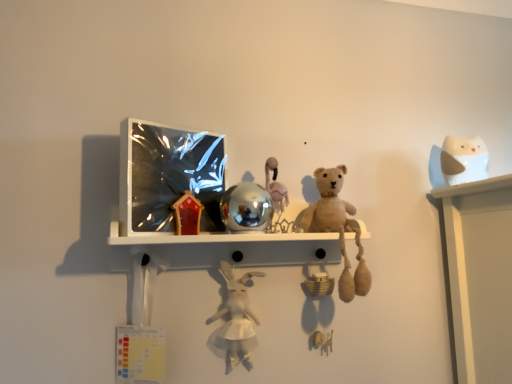
Where is `metallic reflective shelf at center`? This screenshot has height=384, width=512. metallic reflective shelf at center is located at coordinates (213, 237).

What do you see at coordinates (463, 160) in the screenshot?
I see `white matte owl at upper right, which appears as the 4th toy when viewed from the left` at bounding box center [463, 160].

What do you see at coordinates (236, 318) in the screenshot? I see `white plush rabbit at center, which appears as the 4th toy when viewed from the right` at bounding box center [236, 318].

Describe the element at coordinates (337, 228) in the screenshot. I see `fuzzy beige teddy bear at center, marked as the second toy in a right-to-left arrangement` at that location.

The image size is (512, 384). What do you see at coordinates (246, 207) in the screenshot? I see `shiny metallic ball at center, which is counted as the second toy, starting from the left` at bounding box center [246, 207].

Find the location of a particular element. This screenshot has height=384, width=512. metallic reflective shelf at center is located at coordinates (213, 237).

Which is farther, (224,222) or (453,183)?

The point (453,183) is more distant.

Which of these two, shiny metallic ball at center, which is counted as the third toy, starting from the right, or white matte owl at upper right, positioned as the 1th toy in right-to-left order, is smaller?

With smaller size is white matte owl at upper right, positioned as the 1th toy in right-to-left order.

From a real-world perspective, which is physically above, shiny metallic ball at center, which is counted as the third toy, starting from the right, or white matte owl at upper right, which appears as the 4th toy when viewed from the left?

In real-world perspective, white matte owl at upper right, which appears as the 4th toy when viewed from the left, is above.

Consider the image. Is shiny metallic ball at center, which is counted as the third toy, starting from the right, with white matte owl at upper right, which appears as the 4th toy when viewed from the left?

No, shiny metallic ball at center, which is counted as the third toy, starting from the right, is not in contact with white matte owl at upper right, which appears as the 4th toy when viewed from the left.

Considering the sizes of objects white matte owl at upper right, positioned as the 1th toy in right-to-left order, and metallic reflective shelf at center in the image provided, who is taller, white matte owl at upper right, positioned as the 1th toy in right-to-left order, or metallic reflective shelf at center?

With more height is white matte owl at upper right, positioned as the 1th toy in right-to-left order.

Is white matte owl at upper right, which appears as the 4th toy when viewed from the left, oriented towards metallic reflective shelf at center?

No, white matte owl at upper right, which appears as the 4th toy when viewed from the left, is not aimed at metallic reflective shelf at center.

Which is more distant, [462,170] or [290,240]?

The point [462,170] is more distant.

Does white matte owl at upper right, which appears as the 4th toy when viewed from the left, lie in front of metallic reflective shelf at center?

No, white matte owl at upper right, which appears as the 4th toy when viewed from the left, is further to the viewer.

Does metallic reflective shelf at center appear on the right side of white matte owl at upper right, positioned as the 1th toy in right-to-left order?

No.

Locate an element on the screen. The image size is (512, 384). the 3rd toy behind the metallic reflective shelf at center is located at coordinates (463, 160).

Is metallic reflective shelf at center behind white matte owl at upper right, positioned as the 1th toy in right-to-left order?

No, metallic reflective shelf at center is closer to the viewer.

Considering the sizes of objects shiny metallic ball at center, which is counted as the third toy, starting from the right, and metallic reflective shelf at center in the image provided, who is shorter, shiny metallic ball at center, which is counted as the third toy, starting from the right, or metallic reflective shelf at center?

metallic reflective shelf at center.

Does shiny metallic ball at center, which is counted as the second toy, starting from the left, appear on the left side of metallic reflective shelf at center?

No.

Is shiny metallic ball at center, which is counted as the second toy, starting from the left, placed right next to metallic reflective shelf at center?

Yes, the surface of shiny metallic ball at center, which is counted as the second toy, starting from the left, is in contact with metallic reflective shelf at center.

Where is `the 2nd toy above the metallic reflective shelf at center (from the image's perspective)`? Image resolution: width=512 pixels, height=384 pixels. the 2nd toy above the metallic reflective shelf at center (from the image's perspective) is located at coordinates (246, 207).

This screenshot has height=384, width=512. I want to click on the 1st toy in front of the white plush rabbit at center, which appears as the 4th toy when viewed from the right, so click(x=337, y=228).

How much distance is there between fuzzy beige teddy bear at center, marked as the second toy in a right-to-left arrangement, and white plush rabbit at center, which appears as the 4th toy when viewed from the right?

fuzzy beige teddy bear at center, marked as the second toy in a right-to-left arrangement, and white plush rabbit at center, which appears as the 4th toy when viewed from the right, are 9.89 inches apart.

From the image's perspective, relative to white plush rabbit at center, which is the first toy in left-to-right order, is fuzzy beige teddy bear at center, marked as the second toy in a right-to-left arrangement, above or below?

From the image's perspective, fuzzy beige teddy bear at center, marked as the second toy in a right-to-left arrangement, appears above white plush rabbit at center, which is the first toy in left-to-right order.

Considering the relative sizes of white plush rabbit at center, which appears as the 4th toy when viewed from the right, and white matte owl at upper right, positioned as the 1th toy in right-to-left order, in the image provided, is white plush rabbit at center, which appears as the 4th toy when viewed from the right, smaller than white matte owl at upper right, positioned as the 1th toy in right-to-left order,?

No, white plush rabbit at center, which appears as the 4th toy when viewed from the right, is not smaller than white matte owl at upper right, positioned as the 1th toy in right-to-left order.

Does white plush rabbit at center, which is the first toy in left-to-right order, lie behind white matte owl at upper right, positioned as the 1th toy in right-to-left order?

No, white plush rabbit at center, which is the first toy in left-to-right order, is closer to the viewer.

In the scene shown: Can you confirm if white plush rabbit at center, which appears as the 4th toy when viewed from the right, is shorter than white matte owl at upper right, positioned as the 1th toy in right-to-left order?

No, white plush rabbit at center, which appears as the 4th toy when viewed from the right, is not shorter than white matte owl at upper right, positioned as the 1th toy in right-to-left order.

Consider the image. Does white plush rabbit at center, which appears as the 4th toy when viewed from the right, have a greater width compared to white matte owl at upper right, which appears as the 4th toy when viewed from the left?

No, white plush rabbit at center, which appears as the 4th toy when viewed from the right, is not wider than white matte owl at upper right, which appears as the 4th toy when viewed from the left.

Locate an element on the screen. The width and height of the screenshot is (512, 384). toy that is the 1st one when counting backward from the shiny metallic ball at center, which is counted as the second toy, starting from the left is located at coordinates (337, 228).

Is the position of shiny metallic ball at center, which is counted as the third toy, starting from the right, more distant than that of fuzzy beige teddy bear at center, marked as the second toy in a right-to-left arrangement?

No, it is not.

In the scene shown: Is shiny metallic ball at center, which is counted as the second toy, starting from the left, not near fuzzy beige teddy bear at center, the third toy when ordered from left to right?

They are positioned close to each other.

At what (x,y) coordinates should I click in order to perform the action: click on toy that is the 2nd one when counting leftward from the white matte owl at upper right, positioned as the 1th toy in right-to-left order. Please return your answer as a coordinate pair (x, y). The width and height of the screenshot is (512, 384). Looking at the image, I should click on pos(246,207).

At what (x,y) coordinates should I click in order to perform the action: click on the 3rd toy behind the metallic reflective shelf at center, starting your count from the anchor. Please return your answer as a coordinate pair (x, y). Looking at the image, I should click on (463, 160).

From the image, which object appears to be nearer to shiny metallic ball at center, which is counted as the second toy, starting from the left, white matte owl at upper right, positioned as the 1th toy in right-to-left order, or metallic reflective shelf at center?

metallic reflective shelf at center lies closer to shiny metallic ball at center, which is counted as the second toy, starting from the left, than the other object.

From the image, which object appears to be nearer to white plush rabbit at center, which is the first toy in left-to-right order, shiny metallic ball at center, which is counted as the third toy, starting from the right, or white matte owl at upper right, which appears as the 4th toy when viewed from the left?

Based on the image, shiny metallic ball at center, which is counted as the third toy, starting from the right, appears to be nearer to white plush rabbit at center, which is the first toy in left-to-right order.

When comparing their distances from metallic reflective shelf at center, does white matte owl at upper right, positioned as the 1th toy in right-to-left order, or fuzzy beige teddy bear at center, marked as the second toy in a right-to-left arrangement, seem closer?

Among the two, fuzzy beige teddy bear at center, marked as the second toy in a right-to-left arrangement, is located nearer to metallic reflective shelf at center.

Looking at the image, which one is located further to white plush rabbit at center, which appears as the 4th toy when viewed from the right, fuzzy beige teddy bear at center, the third toy when ordered from left to right, or shiny metallic ball at center, which is counted as the third toy, starting from the right?

Based on the image, fuzzy beige teddy bear at center, the third toy when ordered from left to right, appears to be further to white plush rabbit at center, which appears as the 4th toy when viewed from the right.

When comparing their distances from white matte owl at upper right, positioned as the 1th toy in right-to-left order, does white plush rabbit at center, which appears as the 4th toy when viewed from the right, or metallic reflective shelf at center seem further?

The object further to white matte owl at upper right, positioned as the 1th toy in right-to-left order, is white plush rabbit at center, which appears as the 4th toy when viewed from the right.

Looking at the image, which one is located further to fuzzy beige teddy bear at center, marked as the second toy in a right-to-left arrangement, white plush rabbit at center, which is the first toy in left-to-right order, or white matte owl at upper right, which appears as the 4th toy when viewed from the left?

white matte owl at upper right, which appears as the 4th toy when viewed from the left, lies further to fuzzy beige teddy bear at center, marked as the second toy in a right-to-left arrangement, than the other object.

When comparing their distances from fuzzy beige teddy bear at center, the third toy when ordered from left to right, does white matte owl at upper right, positioned as the 1th toy in right-to-left order, or white plush rabbit at center, which is the first toy in left-to-right order, seem further?

Among the two, white matte owl at upper right, positioned as the 1th toy in right-to-left order, is located further to fuzzy beige teddy bear at center, the third toy when ordered from left to right.

From the image, which object appears to be nearer to shiny metallic ball at center, which is counted as the third toy, starting from the right, fuzzy beige teddy bear at center, marked as the second toy in a right-to-left arrangement, or white plush rabbit at center, which appears as the 4th toy when viewed from the right?

fuzzy beige teddy bear at center, marked as the second toy in a right-to-left arrangement.

Where is `shelf located between white plush rabbit at center, which is the first toy in left-to-right order, and fuzzy beige teddy bear at center, the third toy when ordered from left to right, in the left-right direction`? shelf located between white plush rabbit at center, which is the first toy in left-to-right order, and fuzzy beige teddy bear at center, the third toy when ordered from left to right, in the left-right direction is located at coordinates (213, 237).

Find the location of a particular element. The image size is (512, 384). shelf between white plush rabbit at center, which appears as the 4th toy when viewed from the right, and white matte owl at upper right, which appears as the 4th toy when viewed from the left, in the horizontal direction is located at coordinates (213, 237).

What are the coordinates of `toy that lies between shiny metallic ball at center, which is counted as the second toy, starting from the left, and white plush rabbit at center, which appears as the 4th toy when viewed from the right, from top to bottom` in the screenshot? It's located at (337, 228).

Identify the location of toy between shiny metallic ball at center, which is counted as the third toy, starting from the right, and white matte owl at upper right, which appears as the 4th toy when viewed from the left, in the horizontal direction. (337, 228).